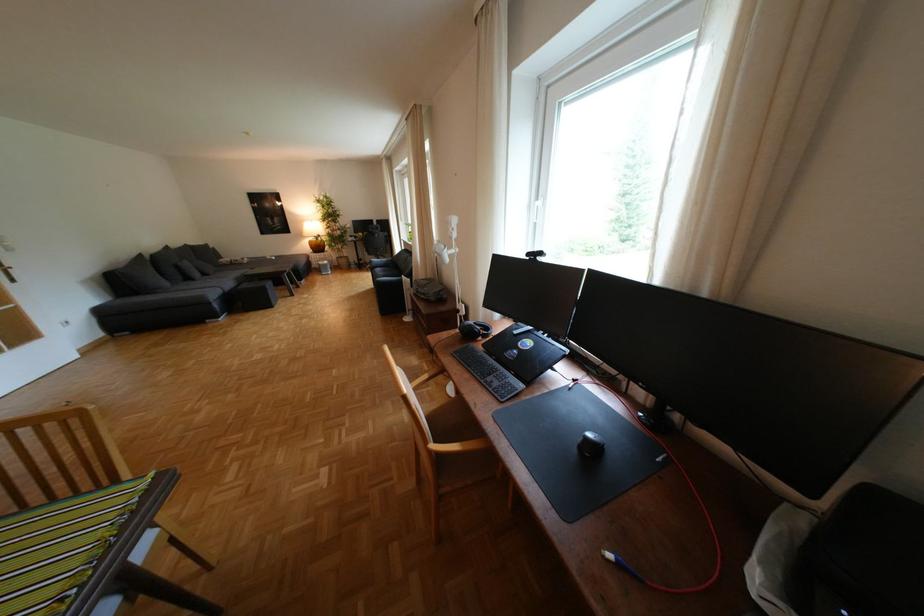
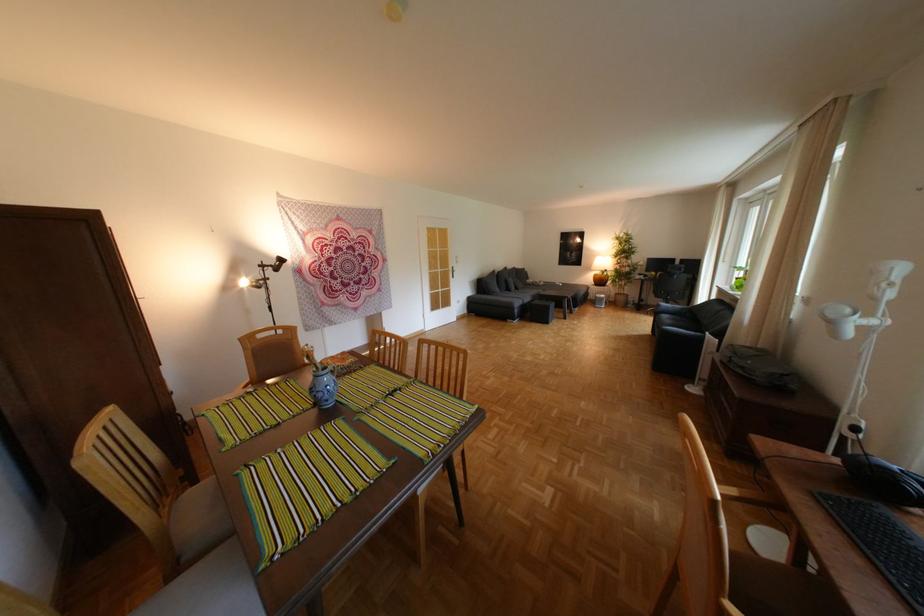
In the second image, find the point that corresponds to [464,238] in the first image.

(888, 299)